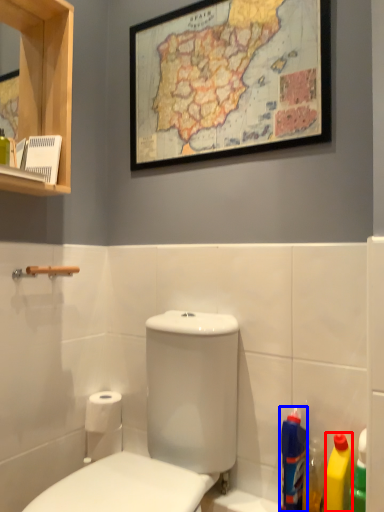
Question: Which object is closer to the camera taking this photo, cleaning product (highlighted by a red box) or cleaning product (highlighted by a blue box)?

Choices:
 (A) cleaning product
 (B) cleaning product

Answer: (A)